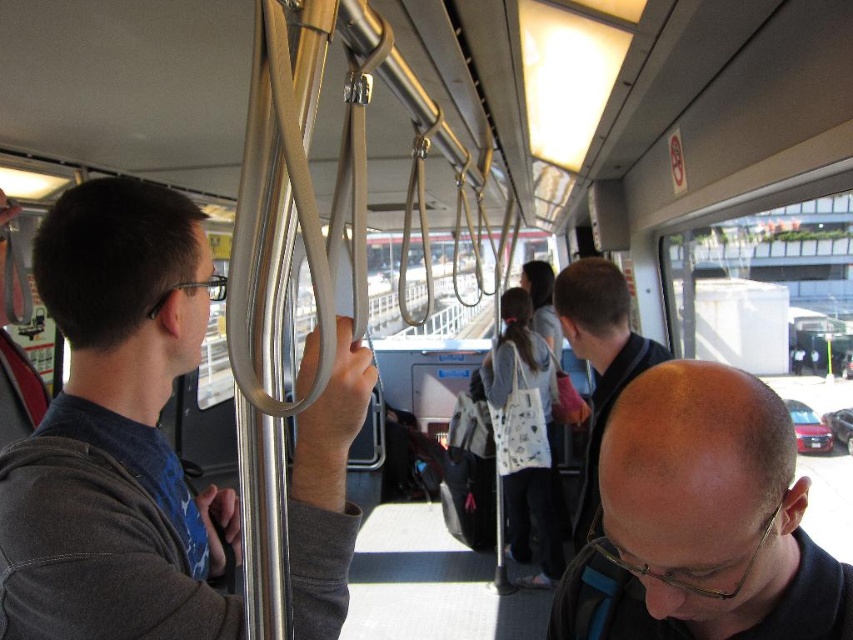
You are a passenger on the train and want to know which of the two points, point (552, 572) or point (596, 282), is closer to you. Based on the scene description, which point is nearer?

Point (552, 572) is further to the camera than point (596, 282), so the closer point to you is point (596, 282).

You are a passenger on a train and need to place your white fabric bag at center on a seat. However, there is a matte gray pole at left nearby. Which object takes up more space?

The white fabric bag at center takes up more space than the matte gray pole at left because the matte gray pole at left has a smaller size compared to white fabric bag at center.